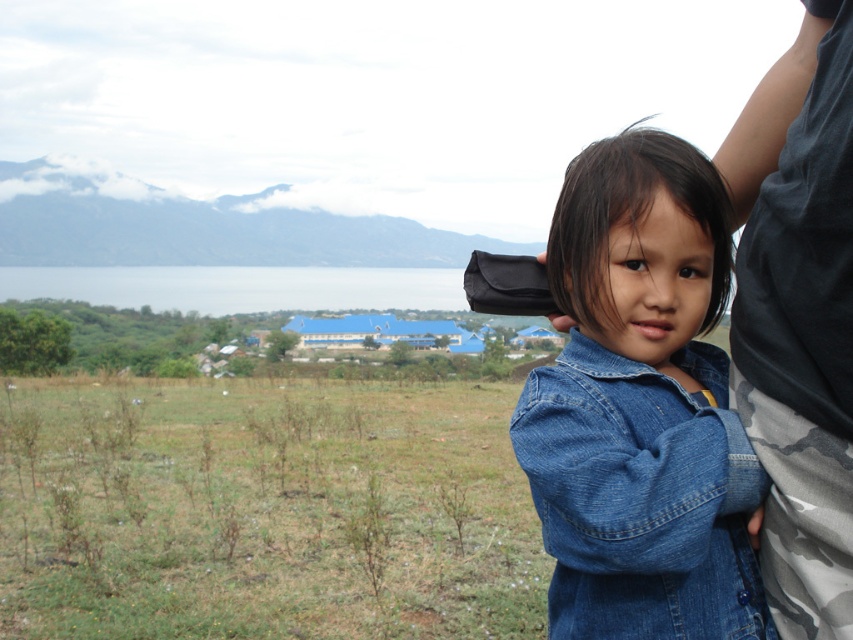
You are navigating a drone through the scene. You need to fly from point A at point (643, 432) to point B at point (837, 604). Considering the spatial relationship between these two points, which direction should you fly to reach point B from point A?

Point (643, 432) is behind point (837, 604), so to fly from point A to point B, you should move forward towards the direction of point B.